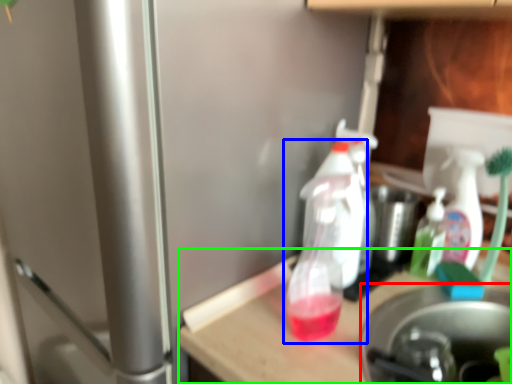
Question: Based on their relative distances, which object is nearer to appliance (highlighted by a red box)? Choose from bottle (highlighted by a blue box) and table (highlighted by a green box).

Choices:
 (A) bottle
 (B) table

Answer: (B)